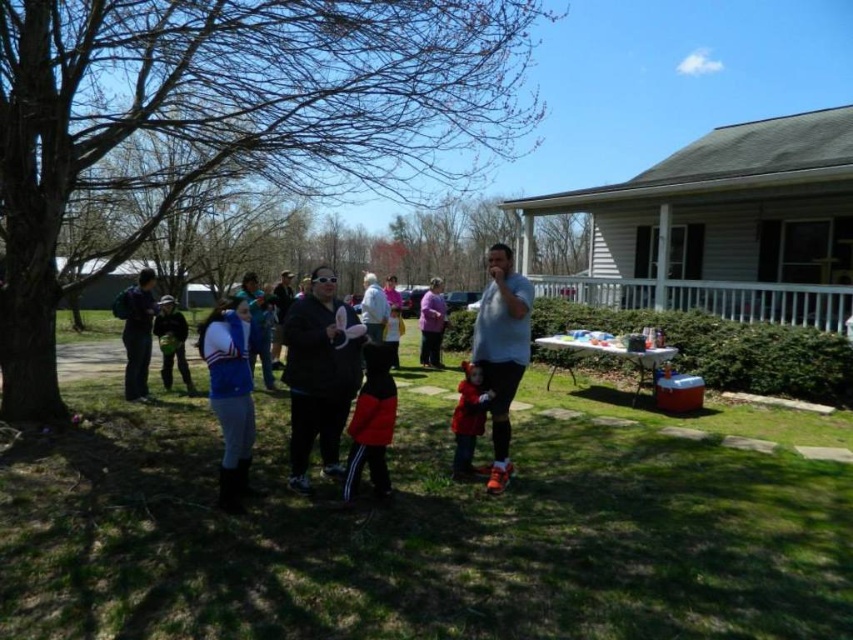
You are a photographer trying to capture a photo of the two red items in the scene. The red fleece jacket at center and the matte red coat at center are both in your viewfinder. Which one will appear larger in your photo?

The red fleece jacket at center will appear larger in the photo because it is closer to the viewer than the matte red coat at center.

You are a photographer trying to capture a photo of both the red fleece jacket at center and the matte red coat at center. Since you want both to be fully visible in the frame, which of the two should you position closer to the camera to ensure the shorter one isn

The red fleece jacket at center is much taller than the matte red coat at center. To ensure both are fully visible, position the matte red coat at center closer to the camera since it is shorter.